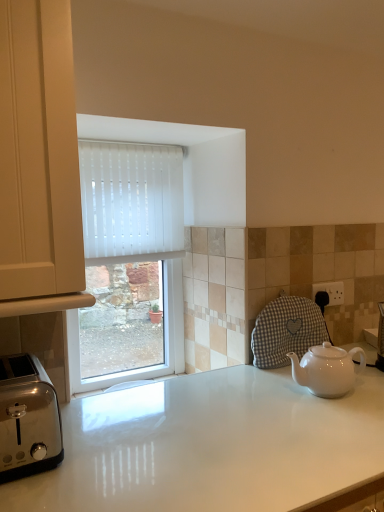
This screenshot has height=512, width=384. In order to click on vacant area that lies to the right of polished stainless steel toaster at lower left in this screenshot , I will do `click(104, 443)`.